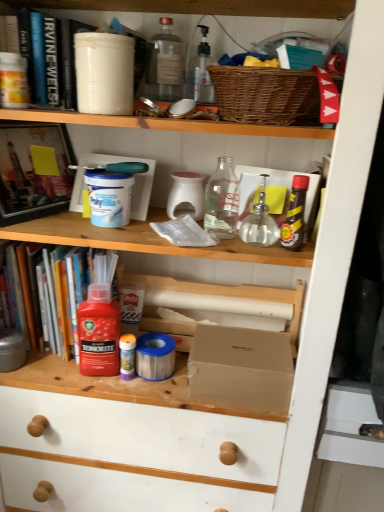
Question: Based on their positions, is woven brown basket at upper center located to the left or right of matte cardboard box at center?

Choices:
 (A) right
 (B) left

Answer: (A)

Question: From a real-world perspective, is woven brown basket at upper center above or below matte cardboard box at center?

Choices:
 (A) below
 (B) above

Answer: (B)

Question: Based on their relative distances, which object is farther from the transparent glass bottle at upper center, positioned as the 5th bottle in bottom-to-top order?

Choices:
 (A) hardcover book at upper left, placed as the third book when sorted from bottom to top
 (B) transparent glass bottle at center, arranged as the fourth bottle when viewed from the left
 (C) translucent plastic bottle at center, which appears as the 1th bottle when ordered from the bottom
 (D) red plastic bottle at left, placed as the 1th book when sorted from bottom to top
 (E) red matte plastic bottle at left, the first bottle in the left-to-right sequence

Answer: (C)

Question: Estimate the real-world distances between objects in this image. Which object is closer to the matte cardboard box at center?

Choices:
 (A) shiny brown bottle at upper right, marked as the third bottle in a bottom-to-top arrangement
 (B) transparent glass bottle at upper center, the first bottle in the top-to-bottom sequence
 (C) red matte plastic bottle at left, the second bottle in the bottom-to-top sequence
 (D) transparent glass bottle at center, the fourth bottle ordered from the bottom
 (E) hardcover book at upper left, the 1th book viewed from the top

Answer: (C)